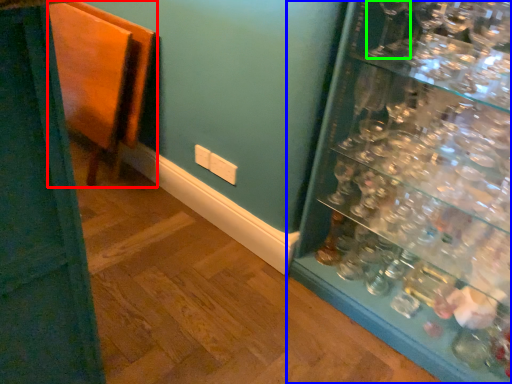
Question: Which is nearer to the furniture (highlighted by a red box)? shelf (highlighted by a blue box) or wine glass (highlighted by a green box).

Choices:
 (A) shelf
 (B) wine glass

Answer: (A)